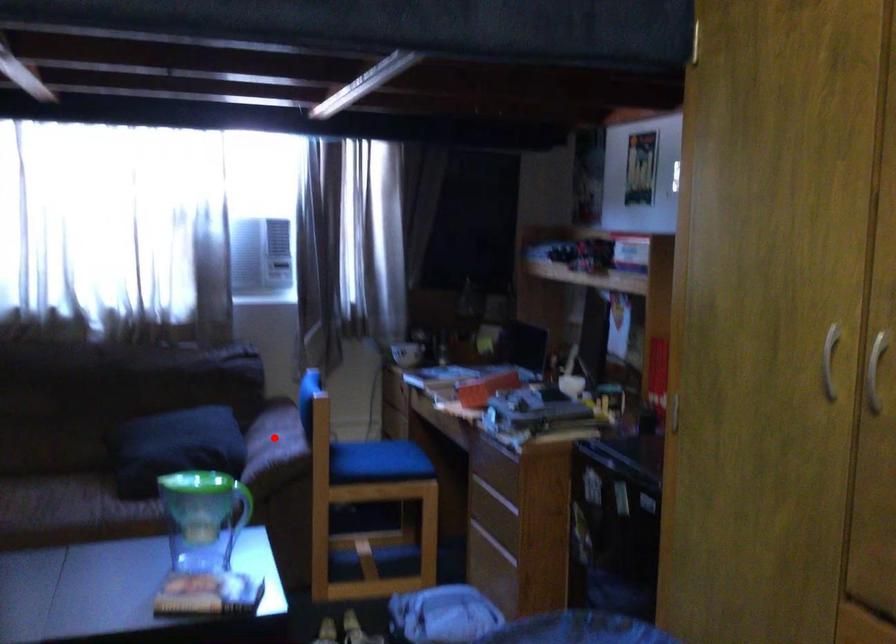
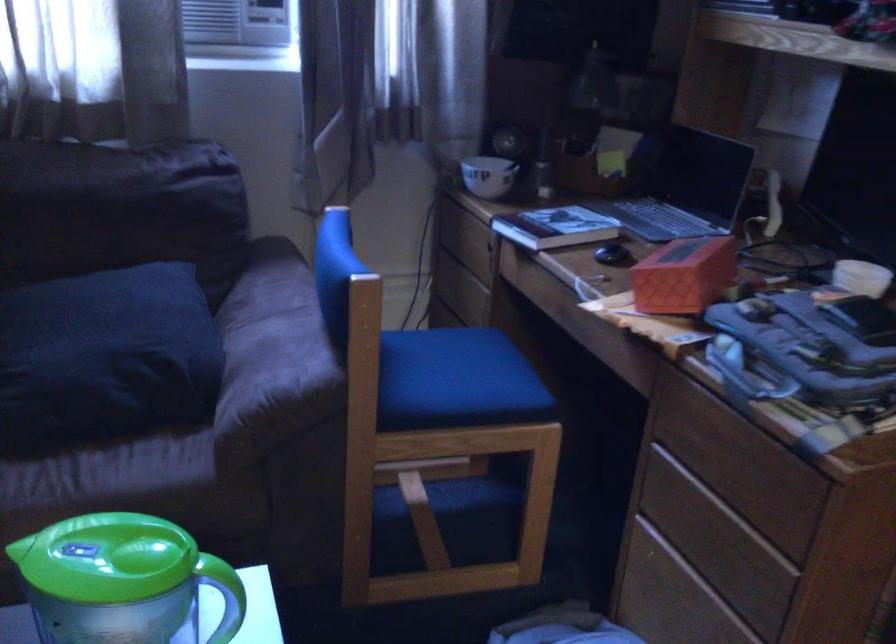
The point at the highlighted location is marked in the first image. Where is the corresponding point in the second image?

(274, 335)